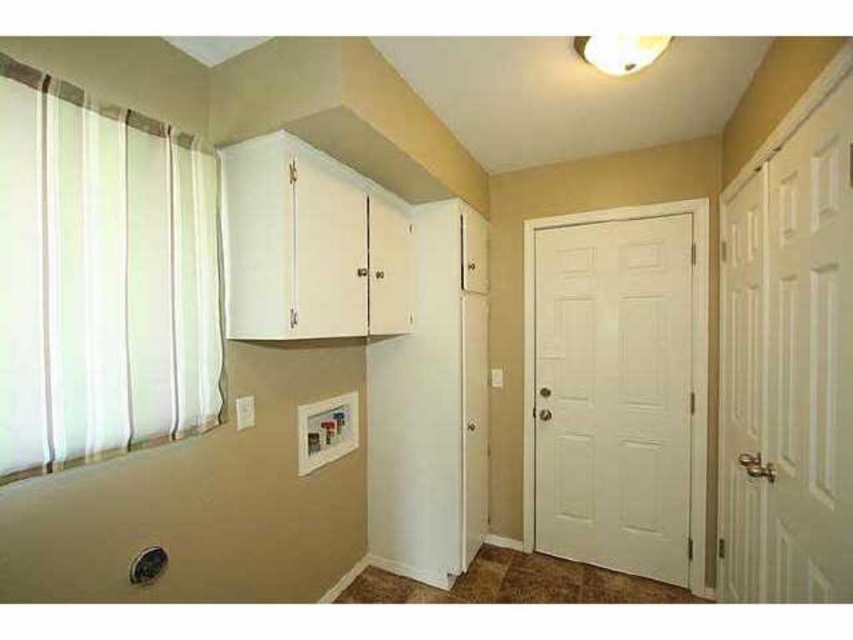
Which is more to the right, white sheer curtain at left or white matte door at right?

white matte door at right is more to the right.

Which is more to the left, white sheer curtain at left or white matte door at right?

white sheer curtain at left

In order to click on white sheer curtain at left in this screenshot , I will do `click(102, 276)`.

Where is `white sheer curtain at left`? The image size is (853, 640). white sheer curtain at left is located at coordinates (102, 276).